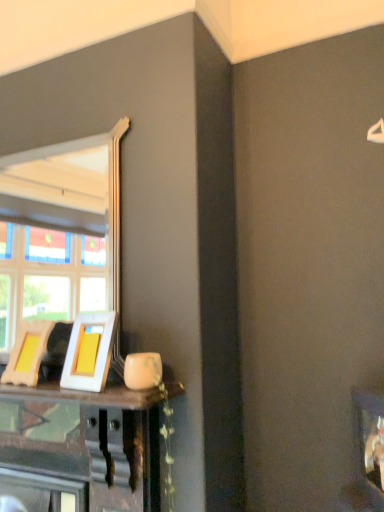
The image size is (384, 512). Describe the element at coordinates (89, 352) in the screenshot. I see `white glossy picture frame at center, the 1th picture frame from the right` at that location.

You are a GUI agent. You are given a task and a screenshot of the screen. Output one action in this format:
    pyautogui.click(x=<x>, y=<y>)
    Task: Click on the white glossy picture frame at center, the 1th picture frame from the right
    This screenshot has height=512, width=384.
    Given the screenshot: What is the action you would take?
    pyautogui.click(x=89, y=352)

How much space does white glossy picture frame at center, the second picture frame viewed from the left, occupy vertically?

11.27 inches.

What is the approximate width of white glossy picture frame at center, the 1th picture frame from the right?

white glossy picture frame at center, the 1th picture frame from the right, is 3.80 inches wide.

Describe the element at coordinates (28, 352) in the screenshot. The height and width of the screenshot is (512, 384). I see `wooden picture frame at lower left, the second picture frame in the right-to-left sequence` at that location.

The height and width of the screenshot is (512, 384). Find the location of `wooden picture frame at lower left, the second picture frame in the right-to-left sequence`. wooden picture frame at lower left, the second picture frame in the right-to-left sequence is located at coordinates (28, 352).

What is the approximate width of wooden picture frame at lower left, the 1th picture frame from the left?

wooden picture frame at lower left, the 1th picture frame from the left, is 3.51 inches wide.

The width and height of the screenshot is (384, 512). What are the coordinates of `white glossy picture frame at center, the 1th picture frame from the right` in the screenshot? It's located at (89, 352).

Is wooden picture frame at lower left, the second picture frame in the right-to-left sequence, to the right of white glossy picture frame at center, the 1th picture frame from the right, from the viewer's perspective?

No, wooden picture frame at lower left, the second picture frame in the right-to-left sequence, is not to the right of white glossy picture frame at center, the 1th picture frame from the right.

Considering the positions of objects wooden picture frame at lower left, the second picture frame in the right-to-left sequence, and white glossy picture frame at center, the second picture frame viewed from the left, in the image provided, who is in front, wooden picture frame at lower left, the second picture frame in the right-to-left sequence, or white glossy picture frame at center, the second picture frame viewed from the left,?

Positioned in front is white glossy picture frame at center, the second picture frame viewed from the left.

Does point (10, 375) come closer to viewer compared to point (105, 313)?

No, (10, 375) is behind (105, 313).

From the image's perspective, is wooden picture frame at lower left, the 1th picture frame from the left, on white glossy picture frame at center, the 1th picture frame from the right?

No, from the image's perspective, wooden picture frame at lower left, the 1th picture frame from the left, is not on top of white glossy picture frame at center, the 1th picture frame from the right.

From a real-world perspective, between wooden picture frame at lower left, the 1th picture frame from the left, and white glossy picture frame at center, the second picture frame viewed from the left, who is vertically lower?

wooden picture frame at lower left, the 1th picture frame from the left, is physically lower.

Which object is thinner, wooden picture frame at lower left, the second picture frame in the right-to-left sequence, or white glossy picture frame at center, the 1th picture frame from the right?

With smaller width is wooden picture frame at lower left, the second picture frame in the right-to-left sequence.

Is wooden picture frame at lower left, the 1th picture frame from the left, taller than white glossy picture frame at center, the second picture frame viewed from the left?

In fact, wooden picture frame at lower left, the 1th picture frame from the left, may be shorter than white glossy picture frame at center, the second picture frame viewed from the left.

Based on the photo, in terms of size, does wooden picture frame at lower left, the 1th picture frame from the left, appear bigger or smaller than white glossy picture frame at center, the 1th picture frame from the right?

Clearly, wooden picture frame at lower left, the 1th picture frame from the left, is smaller in size than white glossy picture frame at center, the 1th picture frame from the right.

Is wooden picture frame at lower left, the 1th picture frame from the left, inside or outside of white glossy picture frame at center, the second picture frame viewed from the left?

wooden picture frame at lower left, the 1th picture frame from the left, cannot be found inside white glossy picture frame at center, the second picture frame viewed from the left.

Is wooden picture frame at lower left, the second picture frame in the right-to-left sequence, beside white glossy picture frame at center, the 1th picture frame from the right?

There is a gap between wooden picture frame at lower left, the second picture frame in the right-to-left sequence, and white glossy picture frame at center, the 1th picture frame from the right.

Does wooden picture frame at lower left, the 1th picture frame from the left, turn towards white glossy picture frame at center, the second picture frame viewed from the left?

No, wooden picture frame at lower left, the 1th picture frame from the left, does not turn towards white glossy picture frame at center, the second picture frame viewed from the left.

Locate an element on the screen. The image size is (384, 512). picture frame above the wooden picture frame at lower left, the second picture frame in the right-to-left sequence (from a real-world perspective) is located at coordinates (89, 352).

Which is more to the left, white glossy picture frame at center, the second picture frame viewed from the left, or wooden picture frame at lower left, the second picture frame in the right-to-left sequence?

Positioned to the left is wooden picture frame at lower left, the second picture frame in the right-to-left sequence.

Considering the positions of objects white glossy picture frame at center, the second picture frame viewed from the left, and wooden picture frame at lower left, the 1th picture frame from the left, in the image provided, who is in front, white glossy picture frame at center, the second picture frame viewed from the left, or wooden picture frame at lower left, the 1th picture frame from the left,?

white glossy picture frame at center, the second picture frame viewed from the left, is in front.

Considering the positions of points (72, 360) and (7, 370), is point (72, 360) farther from camera compared to point (7, 370)?

No, it is not.

From the image's perspective, is white glossy picture frame at center, the second picture frame viewed from the left, above wooden picture frame at lower left, the second picture frame in the right-to-left sequence?

Correct, white glossy picture frame at center, the second picture frame viewed from the left, appears higher than wooden picture frame at lower left, the second picture frame in the right-to-left sequence, in the image.

From a real-world perspective, who is located higher, white glossy picture frame at center, the second picture frame viewed from the left, or wooden picture frame at lower left, the 1th picture frame from the left?

white glossy picture frame at center, the second picture frame viewed from the left, from a real-world perspective.

In the scene shown: Which of these two, white glossy picture frame at center, the second picture frame viewed from the left, or wooden picture frame at lower left, the 1th picture frame from the left, is thinner?

Thinner between the two is wooden picture frame at lower left, the 1th picture frame from the left.

Is white glossy picture frame at center, the second picture frame viewed from the left, taller than wooden picture frame at lower left, the second picture frame in the right-to-left sequence?

Indeed, white glossy picture frame at center, the second picture frame viewed from the left, has a greater height compared to wooden picture frame at lower left, the second picture frame in the right-to-left sequence.

Between white glossy picture frame at center, the second picture frame viewed from the left, and wooden picture frame at lower left, the second picture frame in the right-to-left sequence, which one has larger size?

Bigger between the two is white glossy picture frame at center, the second picture frame viewed from the left.

Is white glossy picture frame at center, the second picture frame viewed from the left, located outside wooden picture frame at lower left, the 1th picture frame from the left?

white glossy picture frame at center, the second picture frame viewed from the left, lies outside wooden picture frame at lower left, the 1th picture frame from the left,'s area.

Is white glossy picture frame at center, the 1th picture frame from the right, not near wooden picture frame at lower left, the second picture frame in the right-to-left sequence?

That's not correct — white glossy picture frame at center, the 1th picture frame from the right, is a little close to wooden picture frame at lower left, the second picture frame in the right-to-left sequence.

Is white glossy picture frame at center, the second picture frame viewed from the left, looking in the opposite direction of wooden picture frame at lower left, the second picture frame in the right-to-left sequence?

white glossy picture frame at center, the second picture frame viewed from the left, is not turned away from wooden picture frame at lower left, the second picture frame in the right-to-left sequence.

Measure the distance between white glossy picture frame at center, the 1th picture frame from the right, and wooden picture frame at lower left, the 1th picture frame from the left.

8.43 inches.

Where is `picture frame below the white glossy picture frame at center, the second picture frame viewed from the left (from the image's perspective)`? picture frame below the white glossy picture frame at center, the second picture frame viewed from the left (from the image's perspective) is located at coordinates (28, 352).

Where is `picture frame located above the wooden picture frame at lower left, the second picture frame in the right-to-left sequence (from the image's perspective)`? picture frame located above the wooden picture frame at lower left, the second picture frame in the right-to-left sequence (from the image's perspective) is located at coordinates (89, 352).

This screenshot has width=384, height=512. Identify the location of picture frame on the right side of wooden picture frame at lower left, the 1th picture frame from the left. (89, 352).